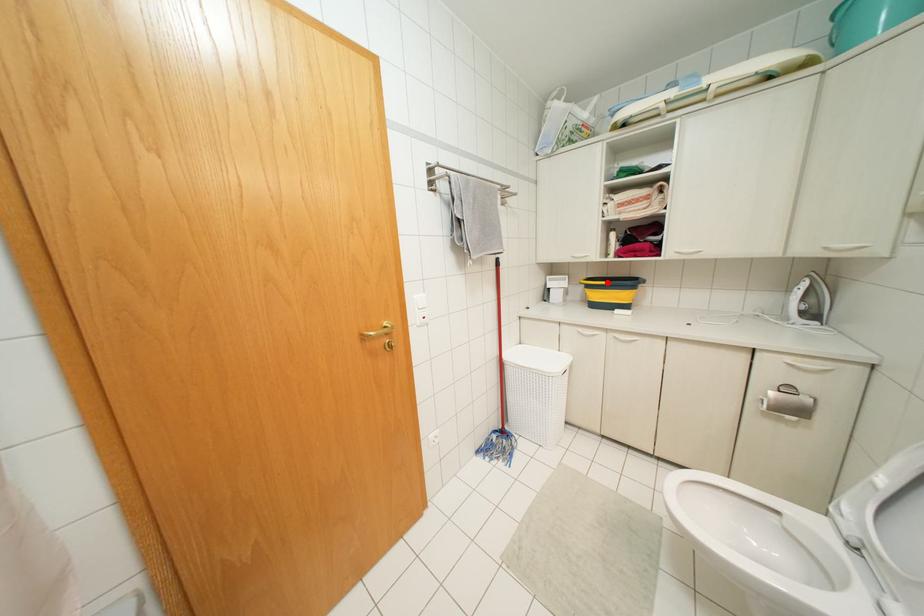
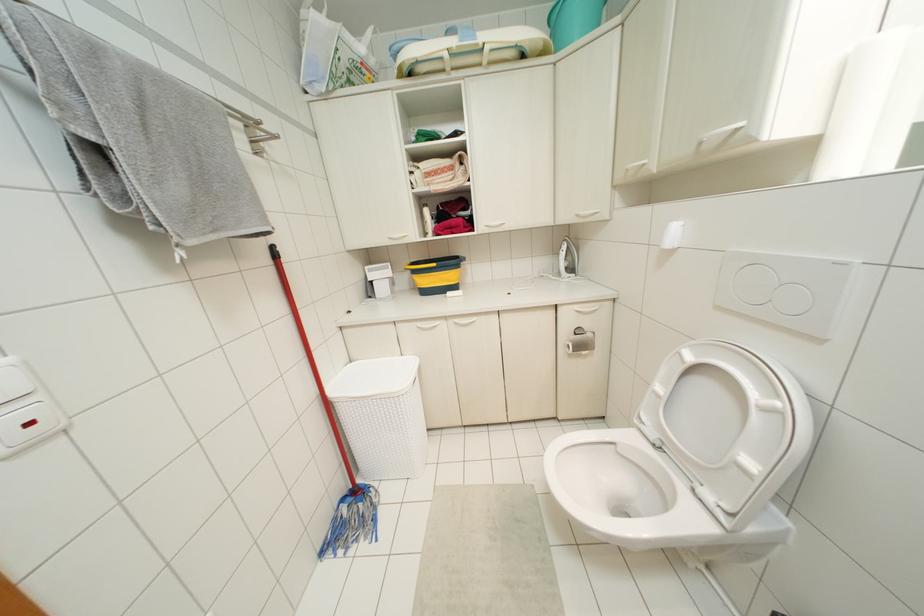
Question: I am providing you with two images of the same scene from different viewpoints. A red point is shown in image1. For the corresponding object point in image2, is it positioned nearer or farther from the camera?

Choices:
 (A) Nearer
 (B) Farther

Answer: (B)